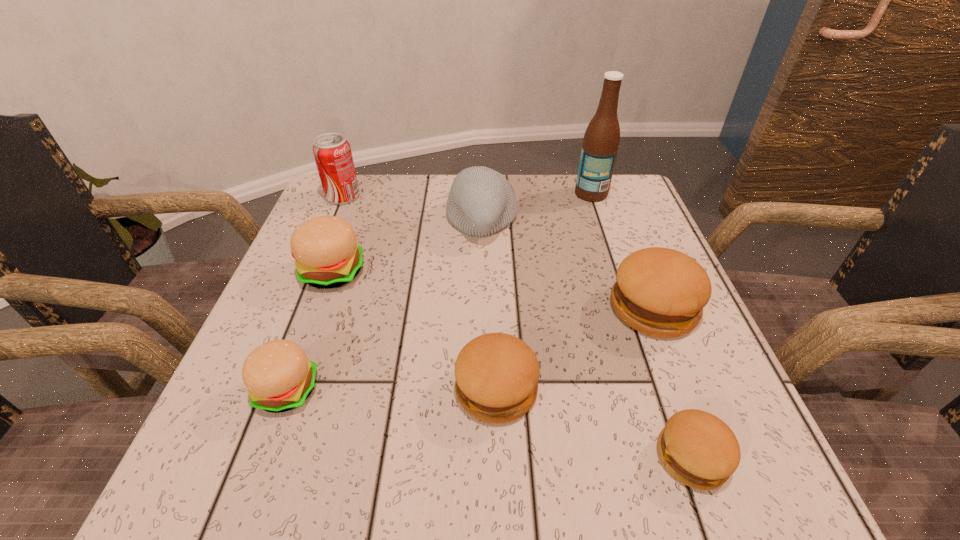
Image resolution: width=960 pixels, height=540 pixels. What are the coordinates of `the smallest brown hamburger` in the screenshot? It's located at (697, 448).

You are a GUI agent. You are given a task and a screenshot of the screen. Output one action in this format:
    pyautogui.click(x=<x>, y=<y>)
    Task: Click on the vacant space located on the left of the beer bottle
    The height and width of the screenshot is (540, 960).
    Given the screenshot: What is the action you would take?
    pyautogui.click(x=460, y=193)

In order to click on vacant space situated on the right of the soda can in this screenshot , I will do `click(384, 197)`.

I want to click on vacant area located 0.170m on the right of the gray beanie, so click(590, 220).

Identify the location of vacant area located on the right of the farther beige hamburger. The height and width of the screenshot is (540, 960). (497, 272).

I want to click on vacant space located 0.190m on the back of the biggest brown hamburger, so point(620,222).

This screenshot has width=960, height=540. I want to click on blank area located on the right of the third hamburger from right to left, so click(612, 389).

You are a GUI agent. You are given a task and a screenshot of the screen. Output one action in this format:
    pyautogui.click(x=<x>, y=<y>)
    Task: Click on the vacant space situated 0.180m on the back of the nearer beige hamburger
    This screenshot has height=540, width=960.
    Given the screenshot: What is the action you would take?
    pyautogui.click(x=324, y=289)

Locate an element on the screen. The width and height of the screenshot is (960, 540). vacant position located 0.370m on the back of the shortest object is located at coordinates (622, 262).

Where is `beer bottle that is at the far edge`? The width and height of the screenshot is (960, 540). beer bottle that is at the far edge is located at coordinates (601, 140).